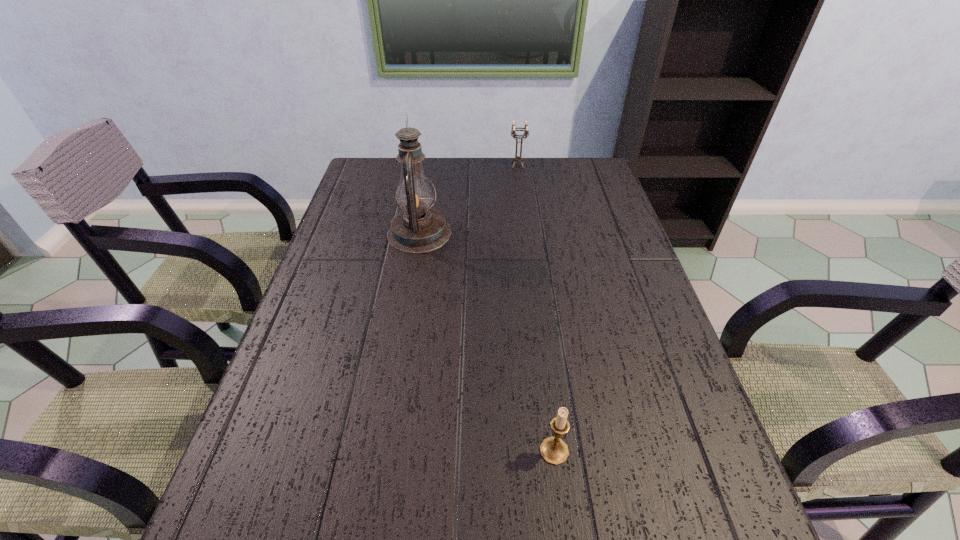
The width and height of the screenshot is (960, 540). What are the coordinates of `free spot at the left edge of the desktop` in the screenshot? It's located at (323, 396).

In the image, there is a desktop. At what (x,y) coordinates should I click in order to perform the action: click on vacant space at the right edge. Please return your answer as a coordinate pair (x, y). The height and width of the screenshot is (540, 960). Looking at the image, I should click on (659, 407).

In the image, there is a desktop. Find the location of `vacant region at the far left corner`. vacant region at the far left corner is located at coordinates (371, 164).

In the image, there is a desktop. Where is `vacant space at the far right corner`? This screenshot has height=540, width=960. vacant space at the far right corner is located at coordinates (561, 185).

Image resolution: width=960 pixels, height=540 pixels. I want to click on free space between the farther candle holder and the nearest object, so click(x=536, y=308).

You are a GUI agent. You are given a task and a screenshot of the screen. Output one action in this format:
    pyautogui.click(x=<x>, y=<y>)
    Task: Click on the blank region between the farthest object and the nearest object
    
    Given the screenshot: What is the action you would take?
    pyautogui.click(x=536, y=308)

Find the location of `free space between the farthest object and the second nearest object`. free space between the farthest object and the second nearest object is located at coordinates (468, 199).

Identify the location of free space between the nearest object and the farthest object. (536, 308).

Identify which object is the nearest to the farthest object. Please provide its 2D coordinates. Your answer should be formatted as a tuple, i.e. [(x, y)], where the tuple contains the x and y coordinates of a point satisfying the conditions above.

[(417, 229)]

Identify which object is located as the nearest to the tallest object. Please provide its 2D coordinates. Your answer should be formatted as a tuple, i.e. [(x, y)], where the tuple contains the x and y coordinates of a point satisfying the conditions above.

[(526, 132)]